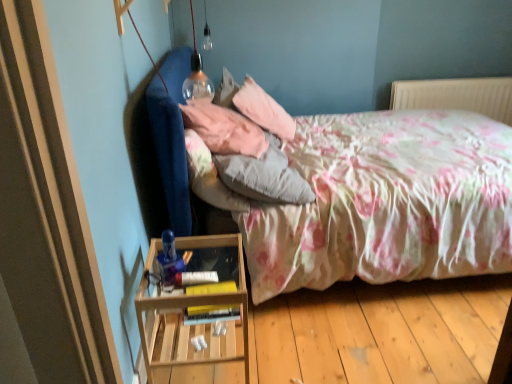
Image resolution: width=512 pixels, height=384 pixels. I want to click on vacant space to the right of wooden at left, so click(x=292, y=341).